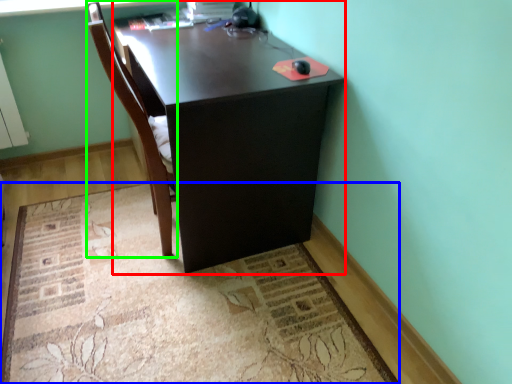
Question: Which object is the closest to the desk (highlighted by a red box)? Choose among these: mat (highlighted by a blue box) or chair (highlighted by a green box).

Choices:
 (A) mat
 (B) chair

Answer: (B)